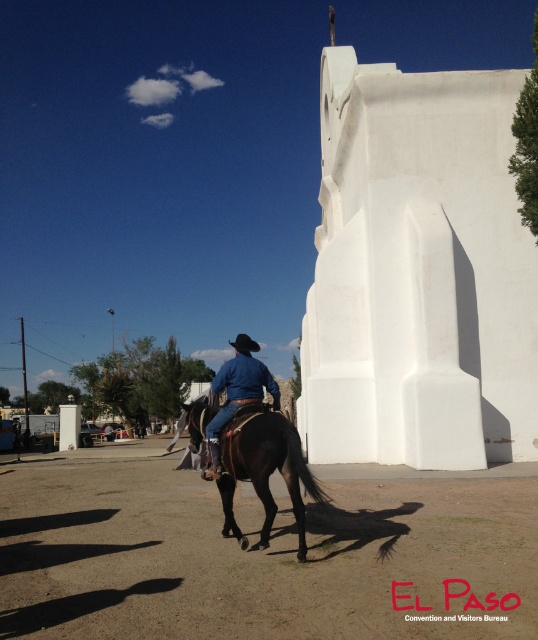
You are a photographer trying to capture the rider and horse in the scene. Since the brown glossy horse at center and the blue denim jeans at center are both in the frame, which one appears closer to you?

The brown glossy horse at center appears closer to the viewer than the blue denim jeans at center.

Consider the image. You are a photographer trying to capture a clear photo of the brown glossy horse at center and the blue denim jeans at center. Since you want both subjects to be in focus, you need to adjust your camera settings. Which subject should you focus on first to ensure both are sharp?

The brown glossy horse at center is smaller than blue denim jeans at center, so you should focus on the blue denim jeans at center first to ensure both are sharp.

You are a photographer trying to capture the brown glossy horse at center and the blue denim jeans at center in a single frame. Since the horse is moving away from you, will you need to zoom in or out to keep both objects in focus?

The brown glossy horse at center is thinner than blue denim jeans at center. To keep both in focus, you would need to zoom out to ensure the wider jeans are accommodated within the frame while maintaining the horse in view.